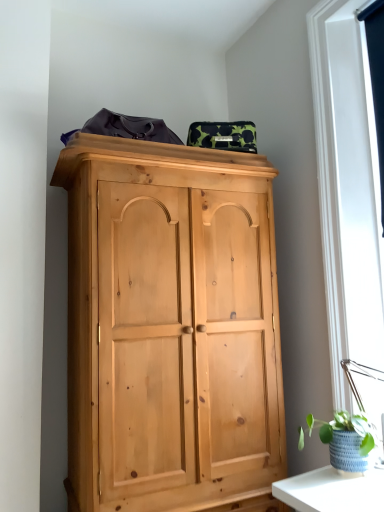
Question: Do you think green woven basket at lower right is within black fabric at upper right, or outside of it?

Choices:
 (A) outside
 (B) inside

Answer: (A)

Question: From a real-world perspective, relative to black fabric at upper right, is green woven basket at lower right vertically above or below?

Choices:
 (A) above
 (B) below

Answer: (B)

Question: In terms of height, does green woven basket at lower right look taller or shorter compared to black fabric at upper right?

Choices:
 (A) tall
 (B) short

Answer: (B)

Question: From the image's perspective, is black fabric at upper right above or below green woven basket at lower right?

Choices:
 (A) above
 (B) below

Answer: (A)

Question: Relative to green woven basket at lower right, is black fabric at upper right in front or behind?

Choices:
 (A) front
 (B) behind

Answer: (B)

Question: From a real-world perspective, relative to green woven basket at lower right, is black fabric at upper right vertically above or below?

Choices:
 (A) below
 (B) above

Answer: (B)

Question: Considering the relative positions of black fabric at upper right and green woven basket at lower right in the image provided, is black fabric at upper right to the left or to the right of green woven basket at lower right?

Choices:
 (A) right
 (B) left

Answer: (A)